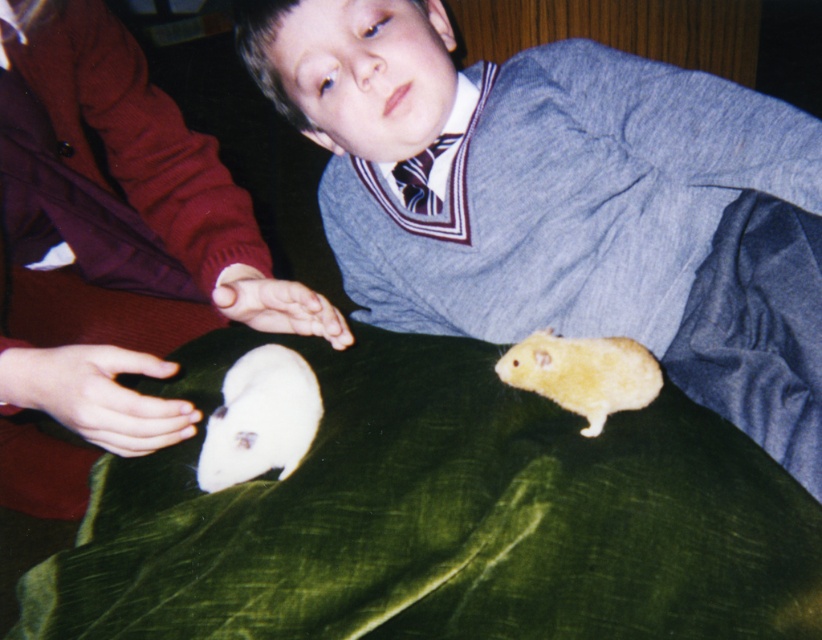
Question: Can you confirm if white fur mouse at lower left is bigger than golden fur hamster at lower right?

Choices:
 (A) yes
 (B) no

Answer: (A)

Question: Among these objects, which one is farthest from the camera?

Choices:
 (A) white fur mouse at lower left
 (B) matte gray sweater at center
 (C) golden fur hamster at lower right

Answer: (A)

Question: Estimate the real-world distances between objects in this image. Which object is closer to the white fur mouse at lower left?

Choices:
 (A) matte gray sweater at center
 (B) golden fur hamster at lower right

Answer: (B)

Question: Which point is closer to the camera taking this photo?

Choices:
 (A) (234, 416)
 (B) (590, 333)

Answer: (A)

Question: Is matte gray sweater at center above golden fur hamster at lower right?

Choices:
 (A) no
 (B) yes

Answer: (B)

Question: Can you confirm if white fur mouse at lower left is smaller than golden fur hamster at lower right?

Choices:
 (A) yes
 (B) no

Answer: (B)